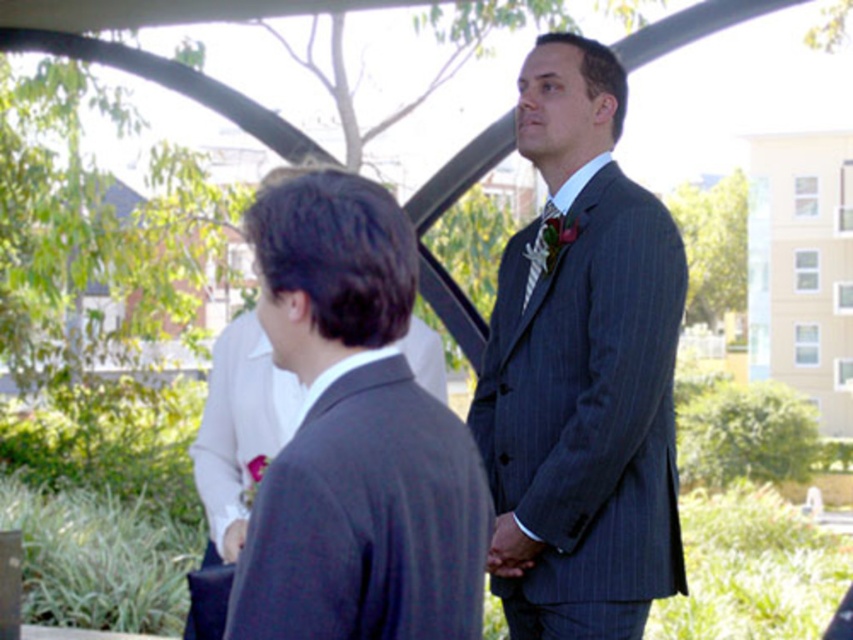
You are a photographer setting up for a portrait shoot in the described outdoor location. You notice the dark gray suit at center and the striped silk tie at center in your frame. Based on their positions, which object should you adjust first to ensure both are centered in your shot?

The dark gray suit at center is located below the striped silk tie at center. To center both in the shot, adjust the dark gray suit at center upwards first so it aligns with the striped silk tie at center.

You are standing at the center of the image and want to find the dark gray suit at center. According to the coordinates provided, in which direction should you look to locate it?

The dark gray suit at center is located at point 0.684 on the x and 0.417 on the y. Since you are at the center, which is coordinates [426,320], the suit is to the right and slightly below your current position. Look to your right and down to find it.

You are standing in the outdoor area under the modern structure. There is a point marked at coordinates point (x=631, y=275). Can you reach that point without moving more than 3 meters from your current position?

The point (x=631, y=275) is 2.97 meters away from the viewer, so yes, you can reach it without moving more than 3 meters from your current position since the distance is within the limit.